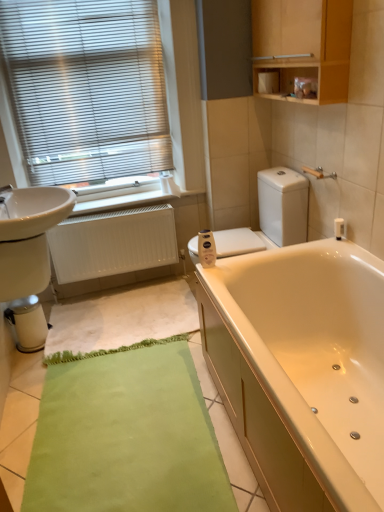
Question: From a real-world perspective, is white matte radiator at lower left over metallic silver water heater at lower left?

Choices:
 (A) yes
 (B) no

Answer: (A)

Question: Can you confirm if white matte radiator at lower left is shorter than metallic silver water heater at lower left?

Choices:
 (A) yes
 (B) no

Answer: (B)

Question: Does white matte radiator at lower left turn towards metallic silver water heater at lower left?

Choices:
 (A) yes
 (B) no

Answer: (A)

Question: Can you confirm if white matte radiator at lower left is smaller than metallic silver water heater at lower left?

Choices:
 (A) yes
 (B) no

Answer: (B)

Question: Can you confirm if white matte radiator at lower left is taller than metallic silver water heater at lower left?

Choices:
 (A) yes
 (B) no

Answer: (A)

Question: From the image's perspective, would you say white matte radiator at lower left is shown under metallic silver water heater at lower left?

Choices:
 (A) no
 (B) yes

Answer: (A)

Question: From the image's perspective, is metallic blinds at upper left on top of white matte toilet paper at center, which is counted as the 2th toilet paper, starting from the right?

Choices:
 (A) no
 (B) yes

Answer: (B)

Question: Can you confirm if metallic blinds at upper left is smaller than white matte toilet paper at center, the 1th toilet paper positioned from the front?

Choices:
 (A) yes
 (B) no

Answer: (B)

Question: From a real-world perspective, is metallic blinds at upper left on white matte toilet paper at center, the first toilet paper viewed from the left?

Choices:
 (A) yes
 (B) no

Answer: (A)

Question: Is metallic blinds at upper left looking in the opposite direction of white matte toilet paper at center, which is counted as the 2th toilet paper, starting from the right?

Choices:
 (A) no
 (B) yes

Answer: (A)

Question: Are metallic blinds at upper left and white matte toilet paper at center, which is the first toilet paper in bottom-to-top order, beside each other?

Choices:
 (A) no
 (B) yes

Answer: (A)

Question: Does metallic blinds at upper left turn towards white matte toilet paper at center, acting as the 2th toilet paper starting from the back?

Choices:
 (A) yes
 (B) no

Answer: (A)

Question: Would you say metallic blinds at upper left is outside white glossy toilet at center?

Choices:
 (A) no
 (B) yes

Answer: (B)